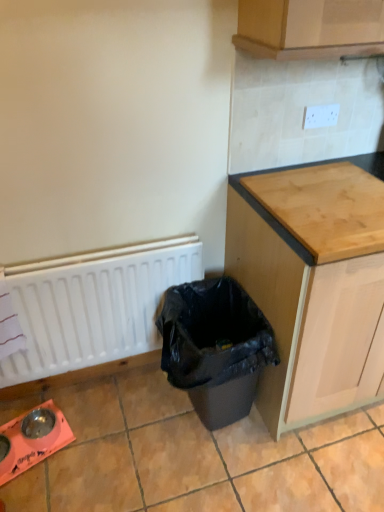
Where is `vacant space situated above white matte radiator at lower left (from a real-world perspective)`? vacant space situated above white matte radiator at lower left (from a real-world perspective) is located at coordinates (81, 256).